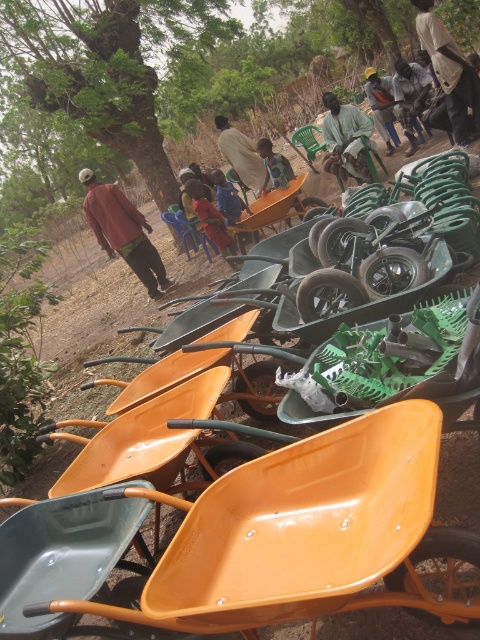
Question: Which point is closer to the camera?

Choices:
 (A) dark gray fabric shirt at center
 (B) matte red shirt at left

Answer: (B)

Question: Does light brown fabric shirt at center appear on the left side of dark gray fabric shirt at center?

Choices:
 (A) no
 (B) yes

Answer: (B)

Question: Which object is farther from the camera taking this photo?

Choices:
 (A) orange plastic wheelbarrow at center
 (B) red plastic chair at center
 (C) dark gray fabric shirt at center
 (D) matte red shirt at left

Answer: (C)

Question: Is red plastic chair at center positioned behind light brown wooden chair at center?

Choices:
 (A) yes
 (B) no

Answer: (B)

Question: Is light brown fabric shirt at upper right thinner than light brown fabric shirt at center?

Choices:
 (A) no
 (B) yes

Answer: (A)

Question: Which point is closer to the camera?

Choices:
 (A) (400, 61)
 (B) (291, 614)
 (C) (265, 140)
 (D) (141, 236)

Answer: (B)